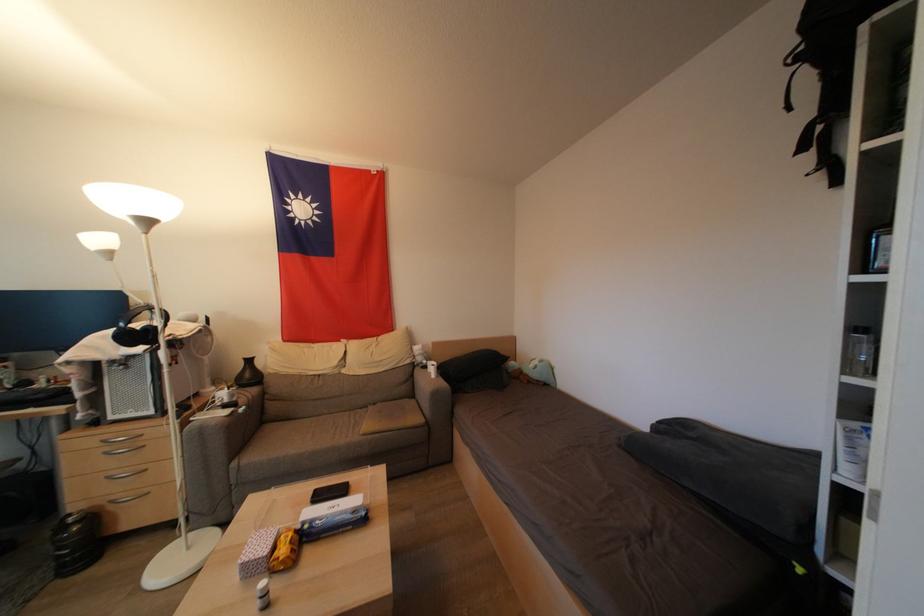
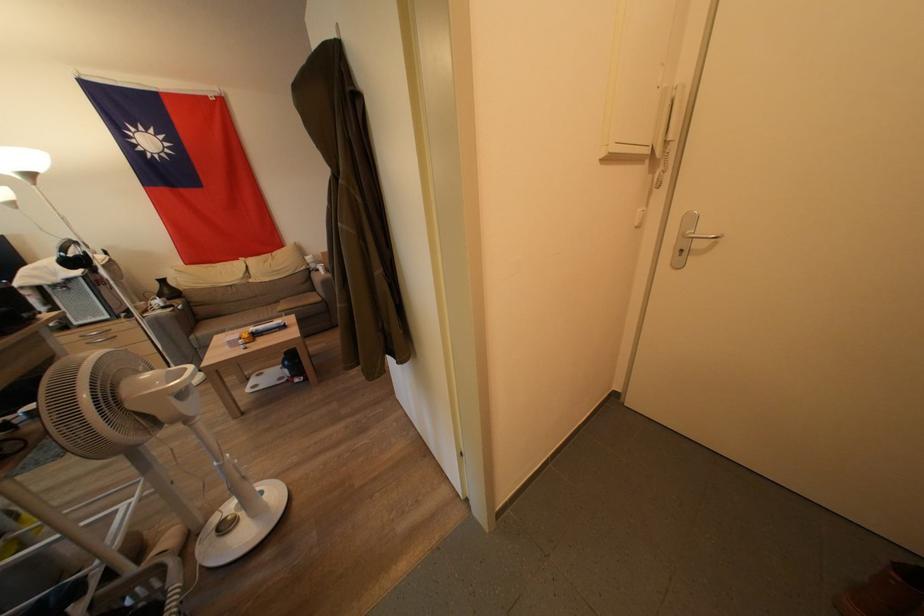
Locate, in the second image, the point that corresponds to (x=422, y=376) in the first image.

(319, 278)